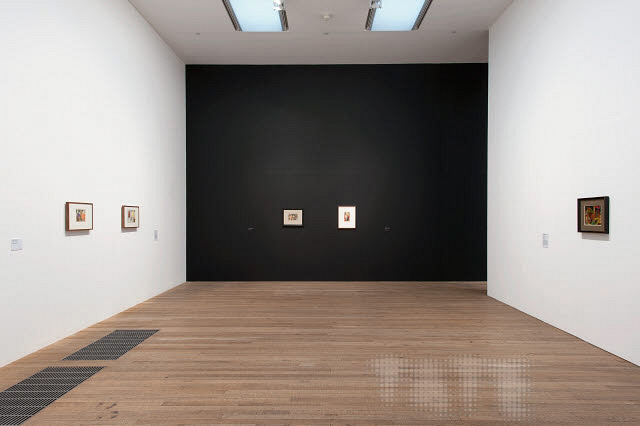
Locate an element on the screen. This screenshot has height=426, width=640. 1 white wall on the right is located at coordinates (539, 135).